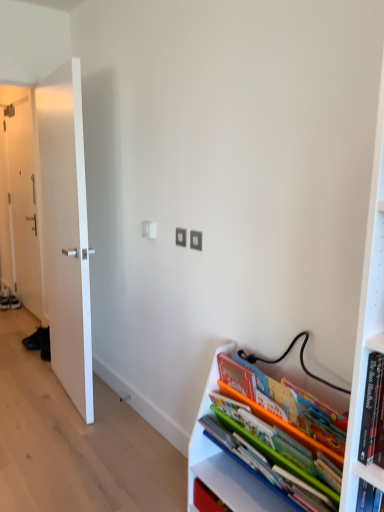
Question: Is white smooth door at left, the 1th door when ordered from front to back, with white matte door at left, placed as the 2th door when sorted from right to left?

Choices:
 (A) no
 (B) yes

Answer: (A)

Question: Is the position of white smooth door at left, the second door positioned from the left, more distant than that of white matte door at left, the 2th door when ordered from front to back?

Choices:
 (A) yes
 (B) no

Answer: (B)

Question: Is white smooth door at left, the 1th door when ordered from front to back, bigger than white matte door at left, the 1th door viewed from the back?

Choices:
 (A) yes
 (B) no

Answer: (A)

Question: Is white smooth door at left, marked as the 1th door in a right-to-left arrangement, in front of white matte door at left, the 1th door viewed from the back?

Choices:
 (A) yes
 (B) no

Answer: (A)

Question: Could white matte door at left, the 2th door when ordered from front to back, be considered to be inside white smooth door at left, which is the second door in back-to-front order?

Choices:
 (A) no
 (B) yes

Answer: (A)

Question: Considering their positions, is white smooth door at left, which is the second door in back-to-front order, located in front of or behind white matte door at left, the 1th door viewed from the back?

Choices:
 (A) front
 (B) behind

Answer: (A)

Question: Considering the positions of white smooth door at left, the second door positioned from the left, and white matte door at left, the 2th door when ordered from front to back, in the image, is white smooth door at left, the second door positioned from the left, bigger or smaller than white matte door at left, the 2th door when ordered from front to back,?

Choices:
 (A) big
 (B) small

Answer: (A)

Question: Is white smooth door at left, marked as the 1th door in a right-to-left arrangement, wider or thinner than white matte door at left, acting as the first door starting from the left?

Choices:
 (A) wide
 (B) thin

Answer: (A)

Question: Would you say white smooth door at left, the 1th door when ordered from front to back, is to the left or to the right of white matte door at left, placed as the 2th door when sorted from right to left, in the picture?

Choices:
 (A) left
 (B) right

Answer: (B)

Question: Is matte plastic books at lower right bigger or smaller than white matte door at left, the 1th door viewed from the back?

Choices:
 (A) big
 (B) small

Answer: (B)

Question: Relative to white matte door at left, the 2th door when ordered from front to back, is matte plastic books at lower right in front or behind?

Choices:
 (A) front
 (B) behind

Answer: (A)

Question: Is matte plastic books at lower right inside or outside of white matte door at left, placed as the 2th door when sorted from right to left?

Choices:
 (A) inside
 (B) outside

Answer: (B)

Question: From their relative heights in the image, would you say matte plastic books at lower right is taller or shorter than white matte door at left, acting as the first door starting from the left?

Choices:
 (A) short
 (B) tall

Answer: (A)

Question: Is white smooth door at left, the 1th door when ordered from front to back, inside or outside of matte plastic books at lower right?

Choices:
 (A) inside
 (B) outside

Answer: (B)

Question: Considering their positions, is white smooth door at left, the 1th door when ordered from front to back, located in front of or behind matte plastic books at lower right?

Choices:
 (A) front
 (B) behind

Answer: (B)